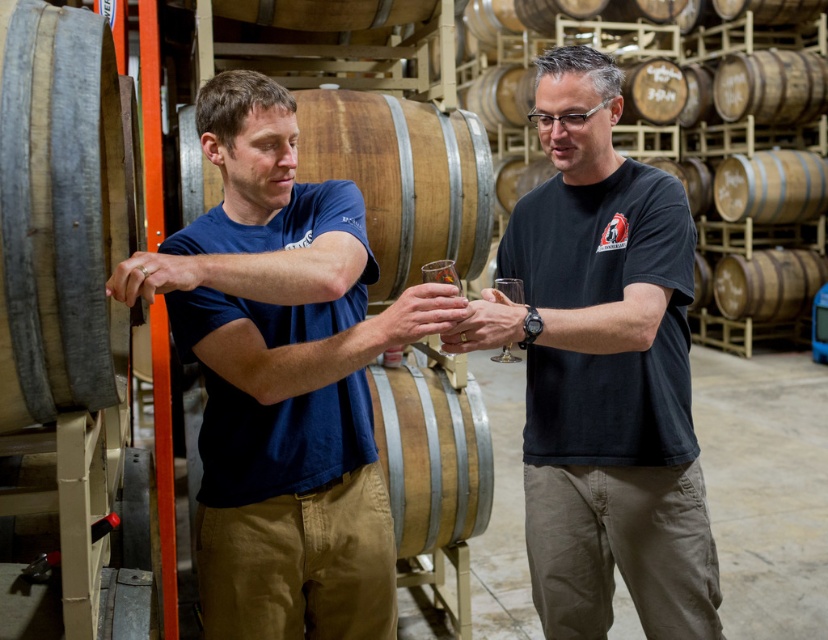
From the picture: Who is more distant from viewer, (392,208) or (508,291)?

Point (392,208)

Is point (444, 237) closer to viewer compared to point (504, 344)?

No, (444, 237) is behind (504, 344).

Find the location of a particular element. wooden barrel at center is located at coordinates (403, 179).

Is blue cotton shirt at center taller than black matte t-shirt at center?

No.

Who is more forward, (297, 452) or (542, 541)?

Point (297, 452) is in front.

I want to click on blue cotton shirt at center, so click(x=283, y=380).

Can you confirm if smooth gray wood barrel at left is positioned above transparent glass at center?

Indeed, smooth gray wood barrel at left is positioned over transparent glass at center.

Between smooth gray wood barrel at left and transparent glass at center, which one has more height?

Standing taller between the two is smooth gray wood barrel at left.

Which is in front, point (42, 186) or point (504, 276)?

Positioned in front is point (42, 186).

The width and height of the screenshot is (828, 640). In order to click on smooth gray wood barrel at left in this screenshot , I will do `click(61, 212)`.